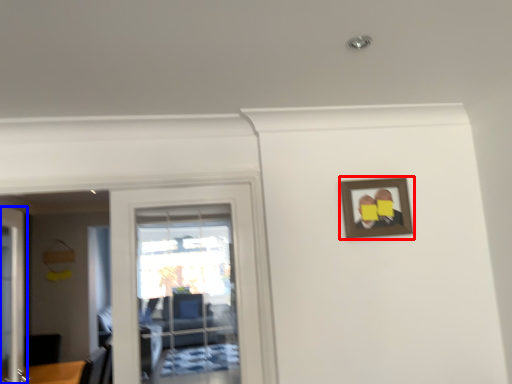
Question: Among these objects, which one is nearest to the camera, picture frame (highlighted by a red box) or door (highlighted by a blue box)?

Choices:
 (A) picture frame
 (B) door

Answer: (B)